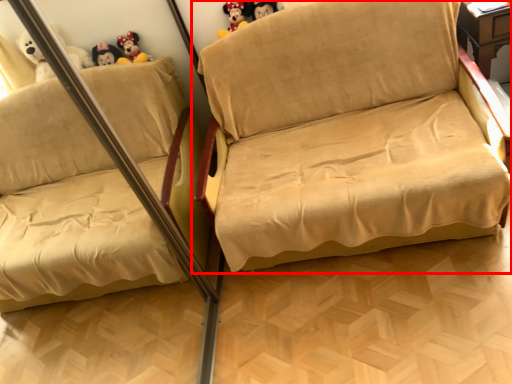
Question: In this image, where is studio couch (annotated by the red box) located relative to toy?

Choices:
 (A) right
 (B) left

Answer: (A)